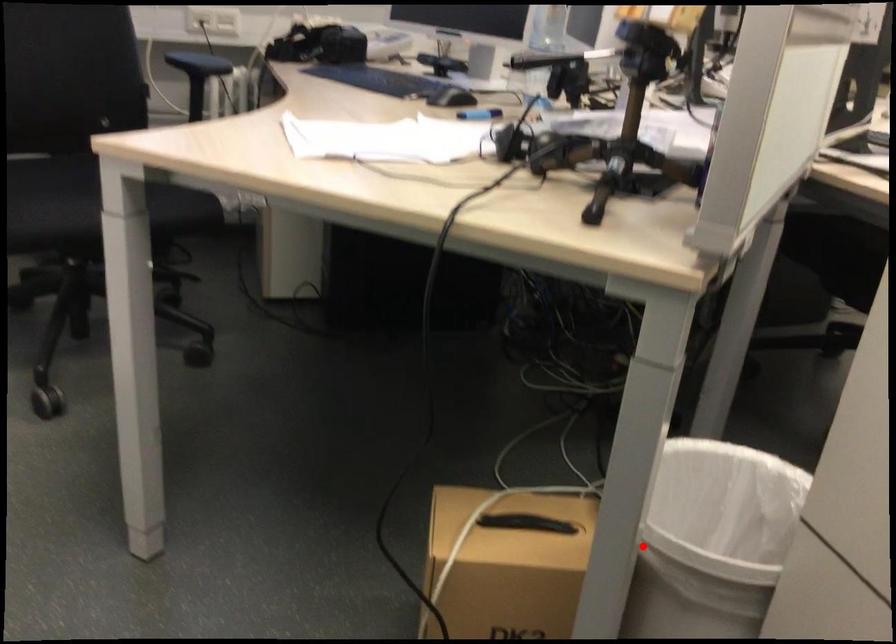
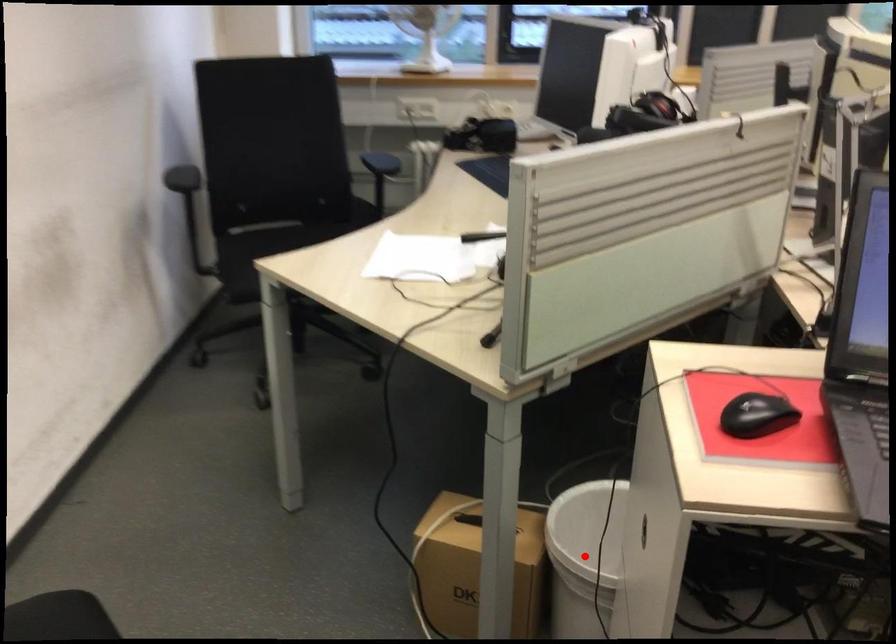
I am providing you with two images of the same scene from different viewpoints. A red point is marked on the first image and another point is marked on the second image. Is the marked point in image1 the same physical position as the marked point in image2?

Yes